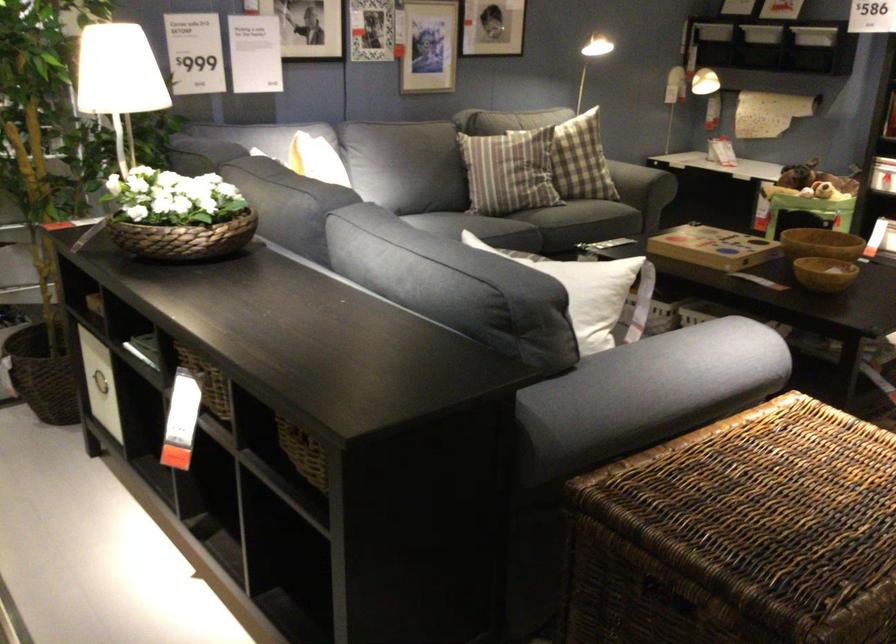
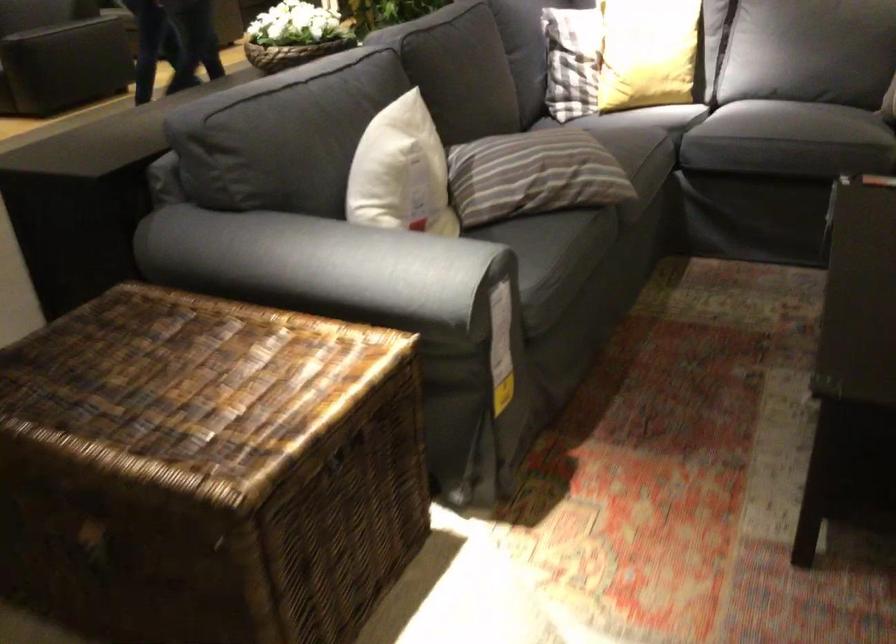
Question: I am providing you with two images of the same scene from different viewpoints. Which of the following objects are not visible in image2?

Choices:
 (A) red can
 (B) grey sofa armrest
 (C) white pillow
 (D) white storage bin

Answer: (D)